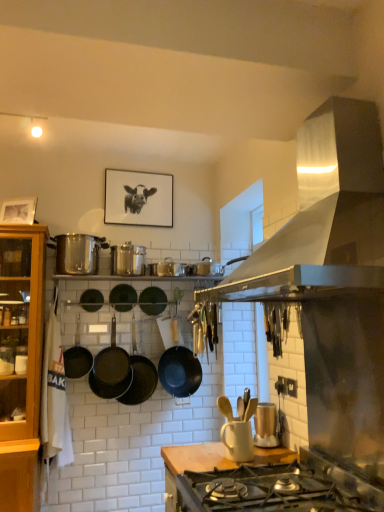
In order to face black matte wok at center, the 3th wok in the right-to-left sequence, should I rotate leftwards or rightwards?

To align with it, rotate left about 7.357°.

The height and width of the screenshot is (512, 384). Find the location of `satin silver range hood at upper right`. satin silver range hood at upper right is located at coordinates (323, 213).

Is black matte picture frame at upper center facing away from matte gold toaster at center, which ranks as the first appliance in bottom-to-top order?

black matte picture frame at upper center does not have its back to matte gold toaster at center, which ranks as the first appliance in bottom-to-top order.

From a real-world perspective, is black matte picture frame at upper center physically located above or below matte gold toaster at center, the second appliance viewed from the top?

In terms of real-world spatial position, black matte picture frame at upper center is above matte gold toaster at center, the second appliance viewed from the top.

Is black matte picture frame at upper center wider or thinner than matte gold toaster at center, the 1th appliance in the front-to-back sequence?

Clearly, black matte picture frame at upper center has less width compared to matte gold toaster at center, the 1th appliance in the front-to-back sequence.

Which point is more forward, (139, 390) or (122, 284)?

The point (139, 390) is more forward.

Which of these two, black matte wok at center, the 3th wok in the right-to-left sequence, or green matte wok at center, the fourth wok viewed from the right, stands shorter?

Standing shorter between the two is green matte wok at center, the fourth wok viewed from the right.

Considering the sizes of objects black matte wok at center, the 5th wok viewed from the left, and green matte wok at center, the fourth wok viewed from the right, in the image provided, who is smaller, black matte wok at center, the 5th wok viewed from the left, or green matte wok at center, the fourth wok viewed from the right,?

Smaller between the two is green matte wok at center, the fourth wok viewed from the right.

Which is more to the left, wooden at center or shiny silver pot at left?

Positioned to the left is shiny silver pot at left.

Does wooden at center turn towards shiny silver pot at left?

No.

Locate an element on the screen. This screenshot has height=512, width=384. countertop that appears below the shiny silver pot at left (from the image's perspective) is located at coordinates (192, 463).

Can you confirm if wooden at center is thinner than shiny silver pot at left?

No, wooden at center is not thinner than shiny silver pot at left.

From the image's perspective, which one is positioned higher, black matte wok at center, the 5th wok viewed from the left, or satin silver range hood at upper right?

satin silver range hood at upper right appears higher in the image.

Which of these two, black matte wok at center, the 5th wok viewed from the left, or satin silver range hood at upper right, is smaller?

Smaller between the two is black matte wok at center, the 5th wok viewed from the left.

Considering the relative positions of black matte wok at center, the 3th wok in the right-to-left sequence, and satin silver range hood at upper right in the image provided, is black matte wok at center, the 3th wok in the right-to-left sequence, to the left or to the right of satin silver range hood at upper right?

black matte wok at center, the 3th wok in the right-to-left sequence, is to the left of satin silver range hood at upper right.

You are a GUI agent. You are given a task and a screenshot of the screen. Output one action in this format:
    pyautogui.click(x=<x>, y=<y>)
    Task: Click on the wok that is the 6th object located below the satin silver range hood at upper right (from the image's perspective)
    
    Given the screenshot: What is the action you would take?
    pyautogui.click(x=140, y=375)

Can you confirm if black matte wok at center, the 2th wok from the right, is positioned to the left of shiny silver pot at left?

Incorrect, black matte wok at center, the 2th wok from the right, is not on the left side of shiny silver pot at left.

From the shiny silver pot at left, count 7th woks backward and point to it. Please provide its 2D coordinates.

[(152, 301)]

Is black matte wok at center, the 2th wok from the right, aimed at shiny silver pot at left?

No, black matte wok at center, the 2th wok from the right, is not aimed at shiny silver pot at left.

Would you say black matte wok at center, the 2th wok from the right, is a long distance from shiny silver pot at left?

They are positioned close to each other.

Is black matte picture frame at upper center not close to shiny silver pot at left?

That's not correct — black matte picture frame at upper center is a little close to shiny silver pot at left.

Is point (166, 200) in front of point (86, 238)?

No, (166, 200) is further to viewer.

Image resolution: width=384 pixels, height=512 pixels. Identify the location of picture frame lying on the right of shiny silver pot at left. (138, 198).

Can you tell me how much black matte picture frame at upper center and shiny silver pot at left differ in facing direction?

The angle between the facing direction of black matte picture frame at upper center and the facing direction of shiny silver pot at left is 0.159 degrees.

Is black matte wok at center, positioned as the 1th wok in left-to-right order, turned away from black matte picture frame at upper center?

black matte wok at center, positioned as the 1th wok in left-to-right order, does not have its back to black matte picture frame at upper center.

Could you measure the distance between black matte wok at center, positioned as the 1th wok in left-to-right order, and black matte picture frame at upper center?

1.01 meters.

Is black matte wok at center, positioned as the 1th wok in left-to-right order, situated inside black matte picture frame at upper center or outside?

The correct answer is: outside.

In the scene shown: Is black matte wok at center, the 7th wok when ordered from right to left, at the right side of black matte picture frame at upper center?

Incorrect, black matte wok at center, the 7th wok when ordered from right to left, is not on the right side of black matte picture frame at upper center.

Starting from the black matte picture frame at upper center, which appliance is the 2nd one in front? Please provide its 2D coordinates.

[(266, 426)]

Identify the location of the 1st wok to the right of the green matte wok at center, the fourth wok in the left-to-right sequence, starting your count from the anchor. (140, 375).

In the scene shown: Based on their spatial positions, is black matte picture frame at upper center or black matte wok at center, which ranks as the 6th wok in left-to-right order, closer to matte gold toaster at center, the 1th appliance in the front-to-back sequence?

The object closer to matte gold toaster at center, the 1th appliance in the front-to-back sequence, is black matte wok at center, which ranks as the 6th wok in left-to-right order.

Estimate the real-world distances between objects in this image. Which object is closer to black matte wok at center, the 6th wok positioned from the right, black matte wok at center, which ranks as the 6th wok in left-to-right order, or shiny silver pot at left?

shiny silver pot at left lies closer to black matte wok at center, the 6th wok positioned from the right, than the other object.

Considering their positions, is matte gold toaster at center, which is the first appliance in right-to-left order, positioned closer to black matte wok at center, which is the 1th wok in right-to-left order, than green matte wok at center, the fourth wok viewed from the right?

green matte wok at center, the fourth wok viewed from the right, lies closer to black matte wok at center, which is the 1th wok in right-to-left order, than the other object.

Which object lies nearer to the anchor point shiny metallic canisters at center, acting as the 1th appliance starting from the top, black matte picture frame at upper center or black matte wok at center, the 7th wok when ordered from right to left?

Among the two, black matte picture frame at upper center is located nearer to shiny metallic canisters at center, acting as the 1th appliance starting from the top.

From the picture: Considering their positions, is black matte wok at center, which ranks as the 6th wok in left-to-right order, positioned closer to black matte picture frame at upper center than shiny metallic canisters at center, the second appliance ordered from the bottom?

shiny metallic canisters at center, the second appliance ordered from the bottom, lies closer to black matte picture frame at upper center than the other object.

Considering their positions, is matte gold toaster at center, the second appliance viewed from the top, positioned further to black matte wok at center, the seventh wok when ordered from left to right, than satin silver range hood at upper right?

The object further to black matte wok at center, the seventh wok when ordered from left to right, is satin silver range hood at upper right.

In the scene shown: When comparing their distances from shiny silver pot at left, does black matte picture frame at upper center or matte gold toaster at center, arranged as the second appliance when viewed from the left, seem closer?

black matte picture frame at upper center is closer to shiny silver pot at left.

Considering their positions, is shiny silver pot at left positioned further to matte gold toaster at center, the second appliance viewed from the top, than black matte wok at center, the 3th wok in the right-to-left sequence?

Based on the image, shiny silver pot at left appears to be further to matte gold toaster at center, the second appliance viewed from the top.

Where is `countertop positioned between satin silver range hood at upper right and green matte wok at center, the fourth wok in the left-to-right sequence, from near to far`? This screenshot has height=512, width=384. countertop positioned between satin silver range hood at upper right and green matte wok at center, the fourth wok in the left-to-right sequence, from near to far is located at coordinates (192, 463).

Identify the location of appliance between shiny silver pot at left and matte gold toaster at center, which ranks as the first appliance in bottom-to-top order. (127, 259).

Where is `pot/pan positioned between wooden at center and black matte wok at center, the 5th wok viewed from the left, from near to far`? The height and width of the screenshot is (512, 384). pot/pan positioned between wooden at center and black matte wok at center, the 5th wok viewed from the left, from near to far is located at coordinates (77, 253).

At what (x,y) coordinates should I click in order to perform the action: click on pot/pan between black matte picture frame at upper center and black matte wok at center, placed as the fifth wok when sorted from right to left, in the up-down direction. Please return your answer as a coordinate pair (x, y). The image size is (384, 512). Looking at the image, I should click on click(77, 253).